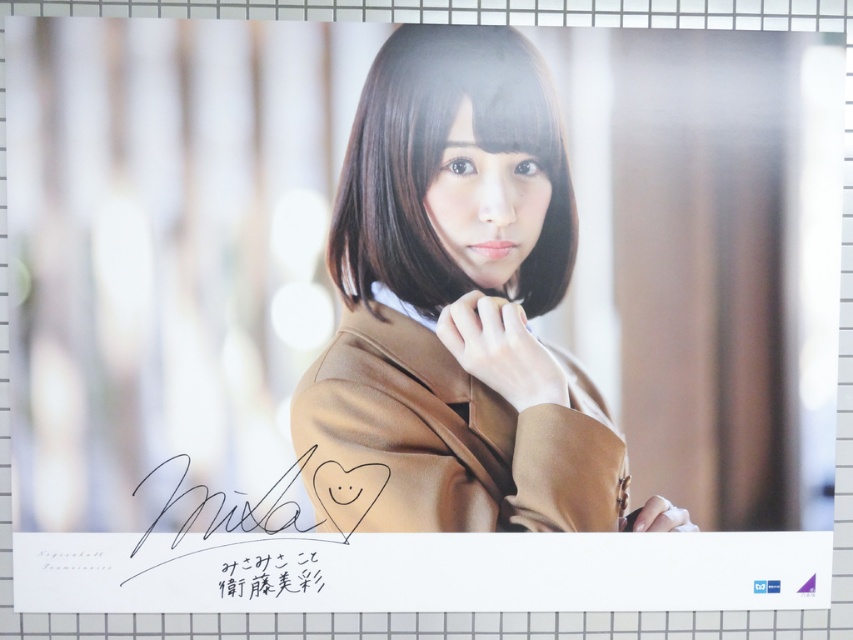
You are an artist who wants to draw the scene shown in the image. You need to decide the placement of the matte brown trench coat at center and the brown silky hair at center. According to the image, which object is located to the right of the other?

The matte brown trench coat at center is positioned on the right side of brown silky hair at center.